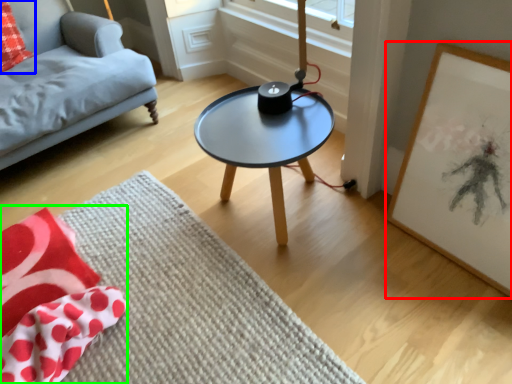
Question: Estimate the real-world distances between objects in this image. Which object is farther from picture frame (highlighted by a red box), throw pillow (highlighted by a blue box) or blanket (highlighted by a green box)?

Choices:
 (A) throw pillow
 (B) blanket

Answer: (A)